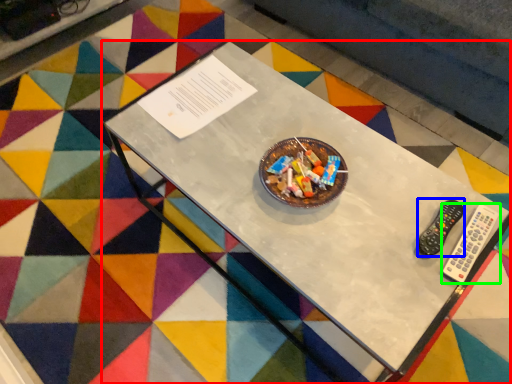
Question: Based on their relative distances, which object is nearer to table (highlighted by a red box)? Choose from control (highlighted by a blue box) and remote control (highlighted by a green box).

Choices:
 (A) control
 (B) remote control

Answer: (A)